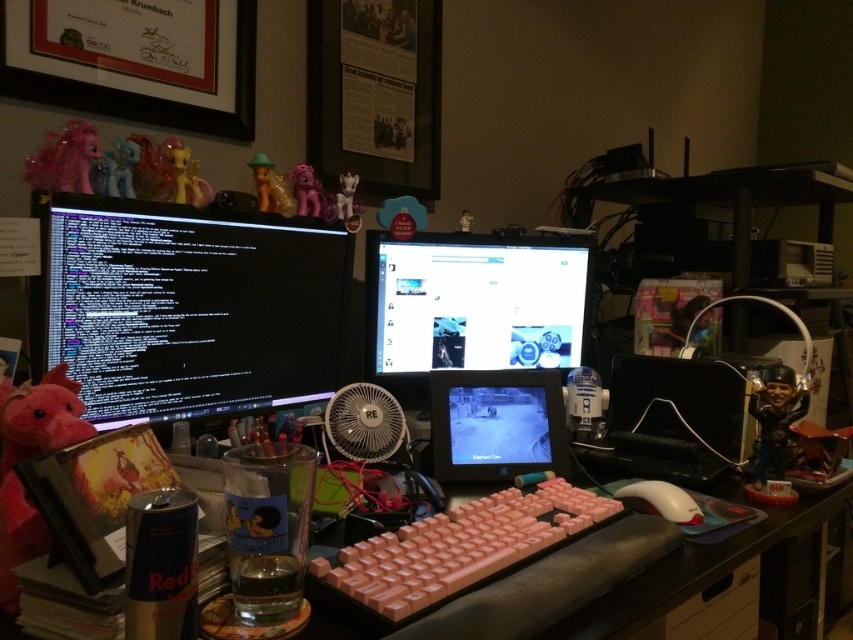
You are organizing the desk and want to place a tall plant between the shiny plastic figurine at right and the pastel yellow plastic pony at upper center. Which object should you move to make space?

The shiny plastic figurine at right is taller than the pastel yellow plastic pony at upper center. Therefore, you should move the shiny plastic figurine at right to make space for the tall plant.

From the picture: You are organizing the desk and want to place a new item between the pink plastic tablet at center and the shiny gold figurine at upper center. Considering their heights, which object should you place the new item closer to?

Since the pink plastic tablet at center is taller than the shiny gold figurine at upper center, you should place the new item closer to the pink plastic tablet at center to maintain a balanced height arrangement.